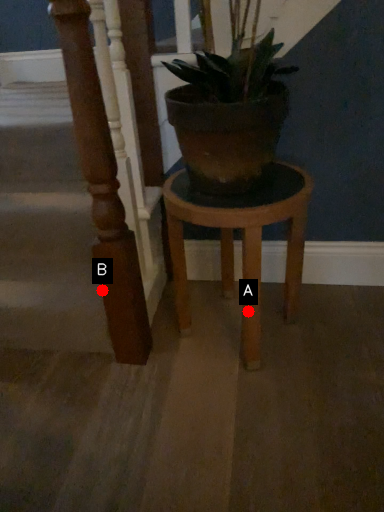
Question: Two points are circled on the image, labeled by A and B beside each circle. Among these points, which one is farthest from the camera?

Choices:
 (A) A is further
 (B) B is further

Answer: (B)